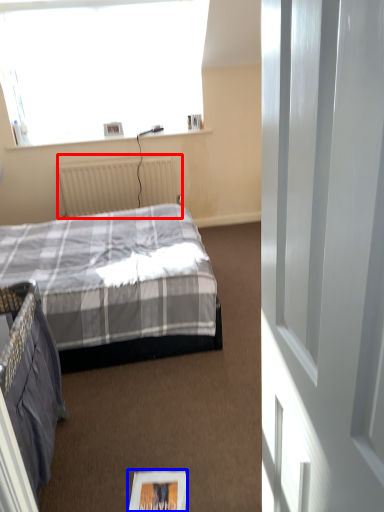
Question: Which of the following is the closest to the observer, radiator (highlighted by a red box) or magazine (highlighted by a blue box)?

Choices:
 (A) radiator
 (B) magazine

Answer: (B)